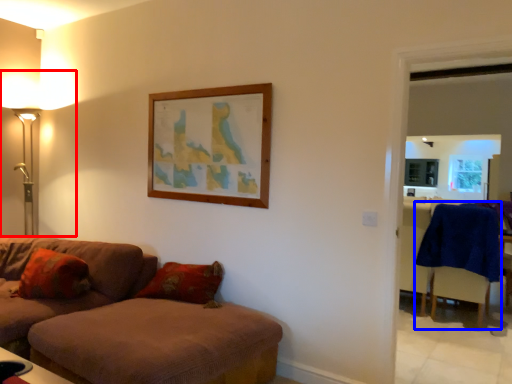
Question: Which of the following is the farthest to the observer, table lamp (highlighted by a red box) or swivel chair (highlighted by a blue box)?

Choices:
 (A) table lamp
 (B) swivel chair

Answer: (B)